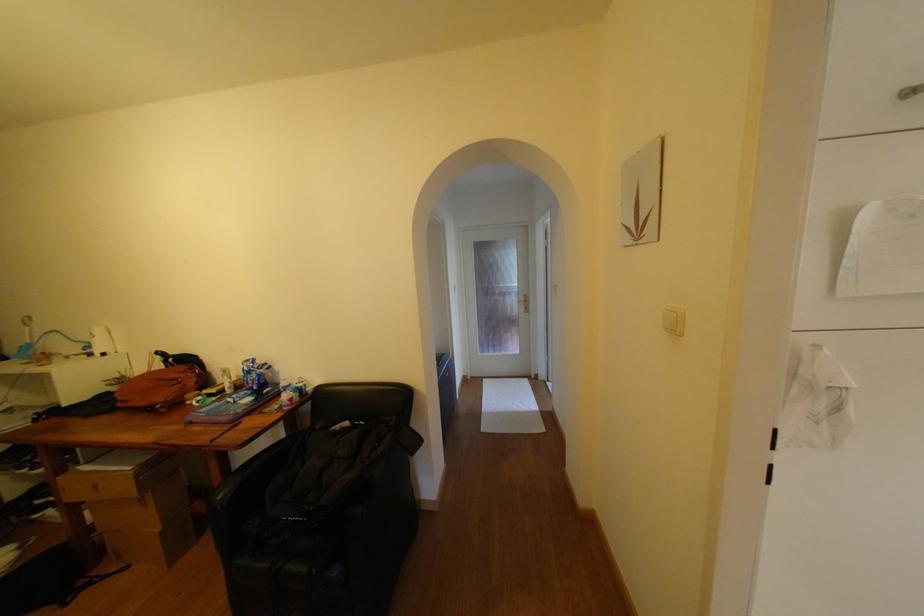
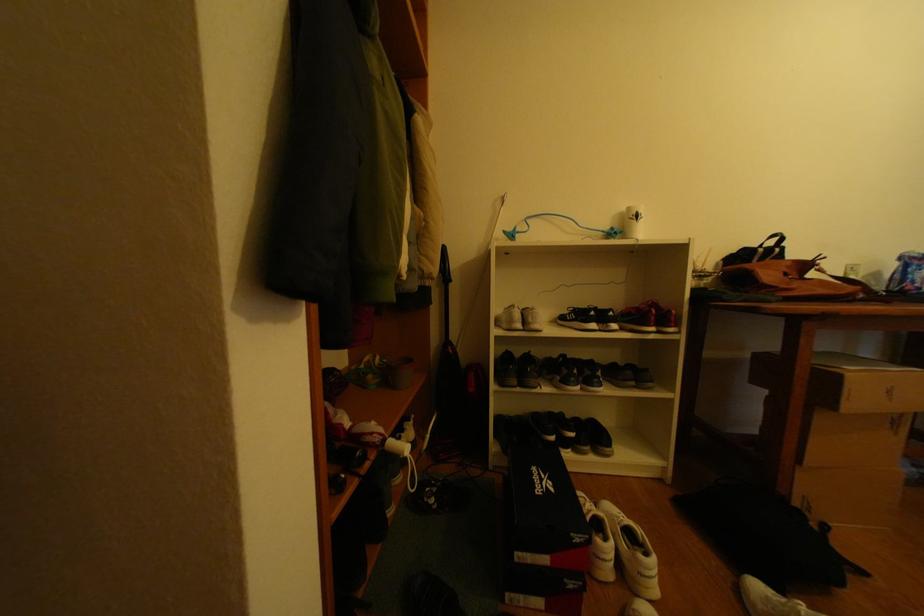
Question: What movement of the cameraman would produce the second image?

Choices:
 (A) Left
 (B) Right
 (C) Forward
 (D) Backward

Answer: (A)